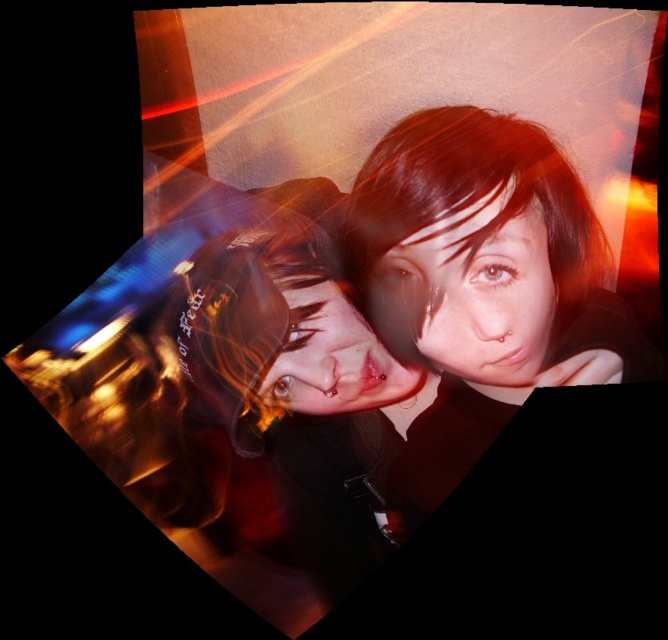
Question: Does matte black hair at center have a lesser width compared to smooth skin face at center?

Choices:
 (A) no
 (B) yes

Answer: (A)

Question: Is matte black hair at center bigger than smooth skin face at center?

Choices:
 (A) yes
 (B) no

Answer: (A)

Question: Which of these objects is positioned closest to the matte red hair at center?

Choices:
 (A) smooth skin face at center
 (B) matte black hair at center

Answer: (B)

Question: Which of the following is the closest to the observer?

Choices:
 (A) (501, 163)
 (B) (285, 356)
 (C) (494, 289)

Answer: (A)

Question: Estimate the real-world distances between objects in this image. Which object is closer to the smooth skin face at center?

Choices:
 (A) matte black hair at center
 (B) matte red hair at center

Answer: (B)

Question: Observing the image, what is the correct spatial positioning of matte black hair at center in reference to matte red hair at center?

Choices:
 (A) left
 (B) right

Answer: (B)